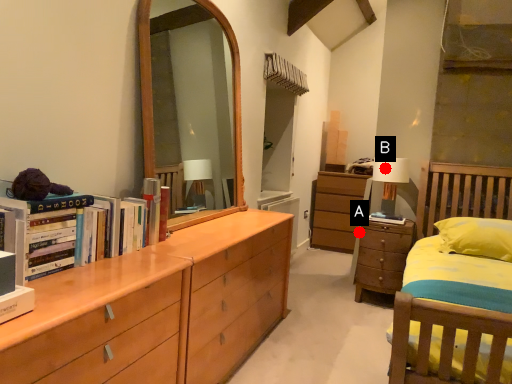
Question: Two points are circled on the image, labeled by A and B beside each circle. Which point is farther to the camera?

Choices:
 (A) A is further
 (B) B is further

Answer: (A)